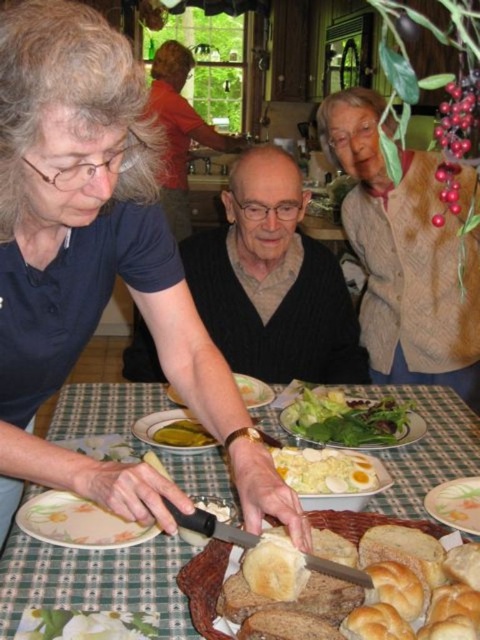
Question: Estimate the real-world distances between objects in this image. Which object is closer to the wooden table at center?

Choices:
 (A) white ceramic platter at lower right
 (B) dark gray sweater at center
 (C) yellow creamy spread at center

Answer: (C)

Question: Which of the following is the farthest from the observer?

Choices:
 (A) white ceramic platter at lower right
 (B) golden brown bread at lower center
 (C) dark gray sweater at center
 (D) white matte bread at lower left

Answer: (C)

Question: Considering the relative positions of golden brown bread at lower center and white glossy plate at center in the image provided, where is golden brown bread at lower center located with respect to white glossy plate at center?

Choices:
 (A) left
 (B) right

Answer: (B)

Question: Can you confirm if yellow creamy spread at center is positioned below white glossy plate at center?

Choices:
 (A) yes
 (B) no

Answer: (A)

Question: Which of the following is the farthest from the observer?

Choices:
 (A) click(144, 620)
 (B) click(315, 310)
 (C) click(87, 540)

Answer: (B)

Question: Is floral ceramic plate at lower left below white matte bread at lower left?

Choices:
 (A) yes
 (B) no

Answer: (B)